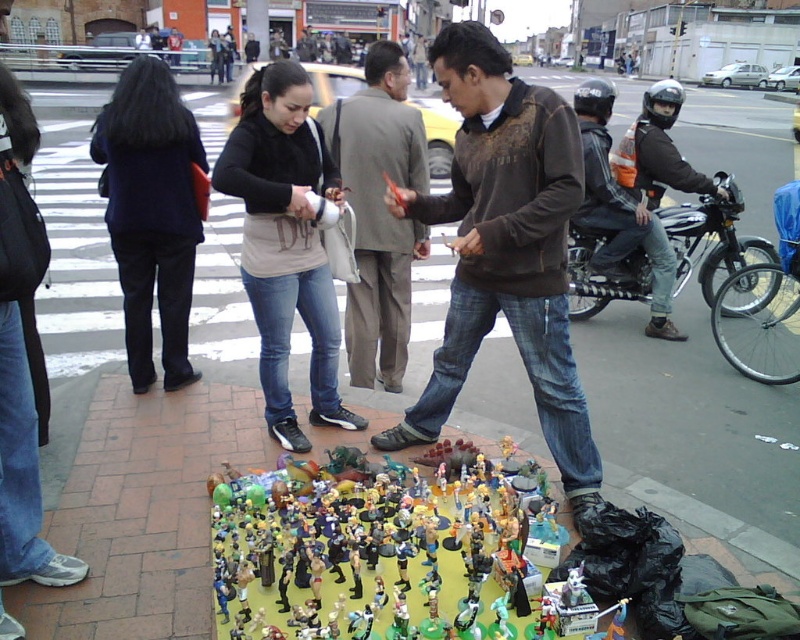
Is brown textured sweater at center closer to camera compared to light brown textured suit at center?

Yes, brown textured sweater at center is in front of light brown textured suit at center.

Does brown textured sweater at center have a larger size compared to light brown textured suit at center?

Yes, brown textured sweater at center is bigger than light brown textured suit at center.

At what (x,y) coordinates should I click in order to perform the action: click on brown textured sweater at center. Please return your answer as a coordinate pair (x, y). The width and height of the screenshot is (800, 640). Looking at the image, I should click on (504, 246).